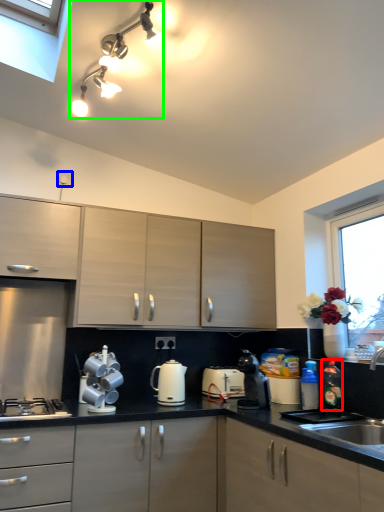
Question: Which object is the closest to the bottle (highlighted by a red box)? Choose among these: electric outlet (highlighted by a blue box) or light fixture (highlighted by a green box).

Choices:
 (A) electric outlet
 (B) light fixture

Answer: (B)